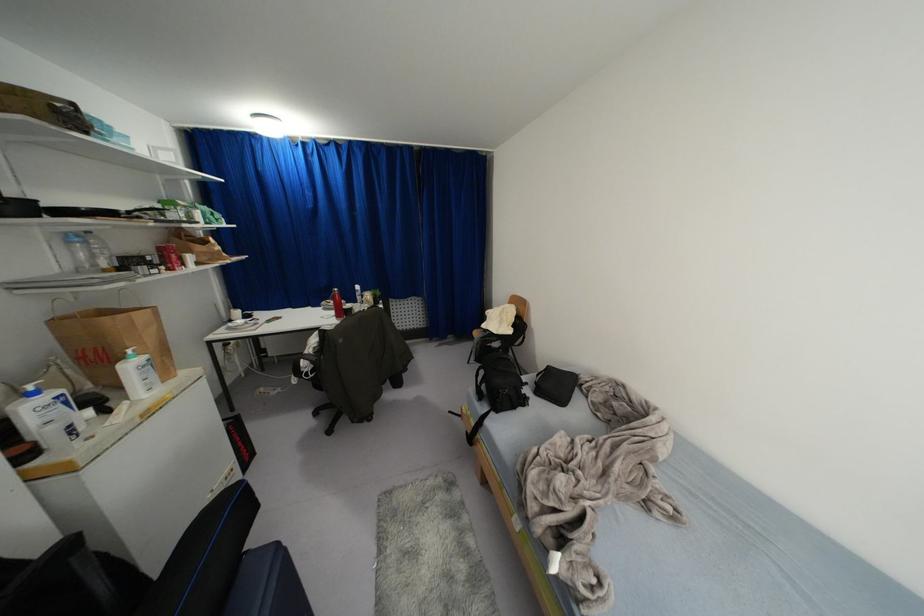
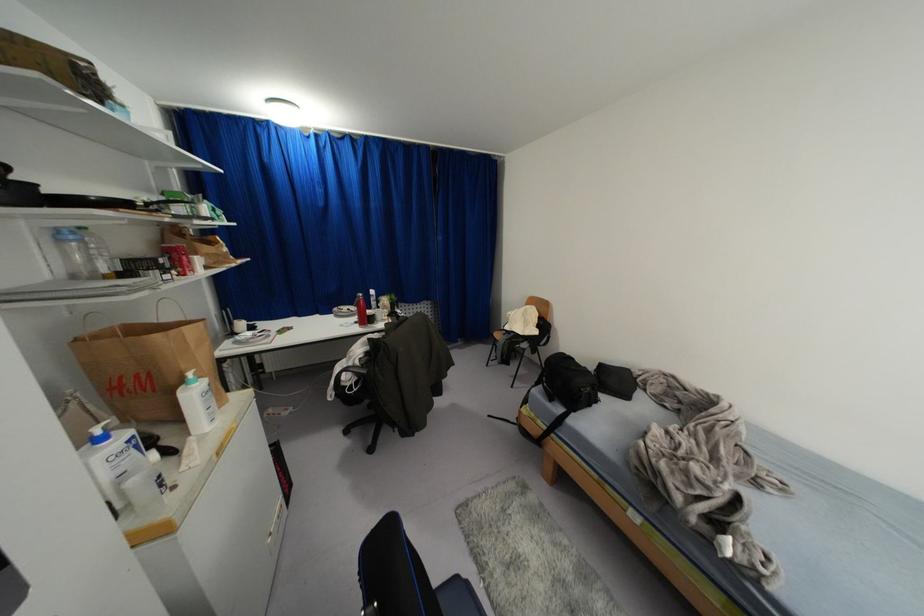
The point at (30, 387) is marked in the first image. Where is the corresponding point in the second image?

(98, 431)